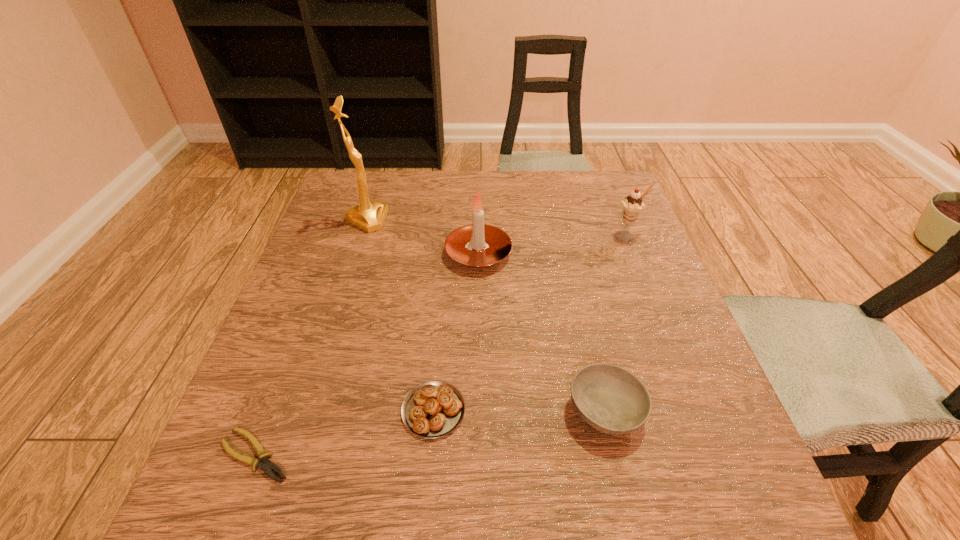
I want to click on free location located on the front of the third shortest object, so click(x=624, y=493).

This screenshot has width=960, height=540. Find the location of `vacant position located 0.060m on the right of the fifth tallest object`. vacant position located 0.060m on the right of the fifth tallest object is located at coordinates pyautogui.click(x=501, y=410).

You are a GUI agent. You are given a task and a screenshot of the screen. Output one action in this format:
    pyautogui.click(x=<x>, y=<y>)
    Task: Click on the free space located 0.300m on the back of the shortest object
    
    Given the screenshot: What is the action you would take?
    pyautogui.click(x=316, y=298)

I want to click on object located in the far edge section of the desktop, so point(369,216).

Find the location of a particular element. This screenshot has height=540, width=960. object that is at the near edge is located at coordinates (267, 466).

At what (x,y) coordinates should I click in order to perform the action: click on award at the left edge. Please return your answer as a coordinate pair (x, y). The height and width of the screenshot is (540, 960). Looking at the image, I should click on (369, 216).

Image resolution: width=960 pixels, height=540 pixels. In order to click on pliers that is positioned at the left edge in this screenshot , I will do `click(267, 466)`.

The height and width of the screenshot is (540, 960). I want to click on icecream situated at the right edge, so click(x=633, y=204).

This screenshot has width=960, height=540. In order to click on bowl situated at the right edge in this screenshot , I will do `click(612, 400)`.

Where is `object at the far left corner`? object at the far left corner is located at coordinates click(x=369, y=216).